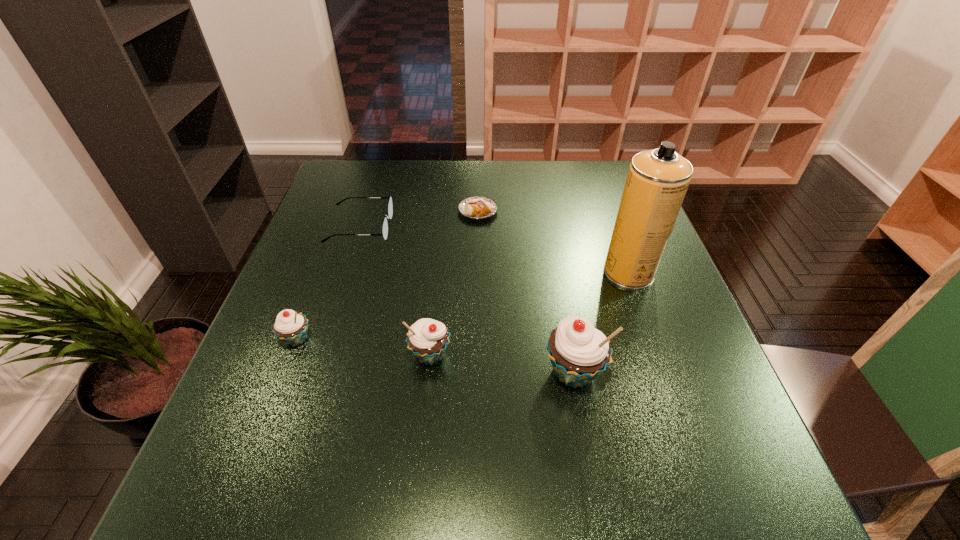
Identify the location of free space located 0.120m on the right of the leftmost cupcake. The height and width of the screenshot is (540, 960). (371, 339).

This screenshot has width=960, height=540. I want to click on vacant region located 0.390m on the back of the third tallest object, so click(x=444, y=225).

Locate an element on the screen. vacant position located 0.180m on the left of the second tallest object is located at coordinates (449, 372).

Image resolution: width=960 pixels, height=540 pixels. In order to click on free space located on the right of the pastry in this screenshot , I will do `click(568, 211)`.

Locate an element on the screen. The image size is (960, 540). vacant space located 0.210m on the lenses of the spectacles is located at coordinates (468, 227).

The height and width of the screenshot is (540, 960). What are the coordinates of `free space located on the left of the aerosol can` in the screenshot? It's located at (459, 272).

At what (x,y) coordinates should I click in order to perform the action: click on object at the far edge. Please return your answer as a coordinate pair (x, y). Looking at the image, I should click on (475, 207).

Image resolution: width=960 pixels, height=540 pixels. I want to click on object positioned at the near edge, so click(x=578, y=352).

This screenshot has height=540, width=960. I want to click on cupcake that is at the left edge, so pyautogui.click(x=291, y=327).

You are a GUI agent. You are given a task and a screenshot of the screen. Output one action in this format:
    pyautogui.click(x=<x>, y=<y>)
    Task: Click on the spectacles that is at the left edge
    This screenshot has height=540, width=960.
    Given the screenshot: What is the action you would take?
    (x=390, y=208)